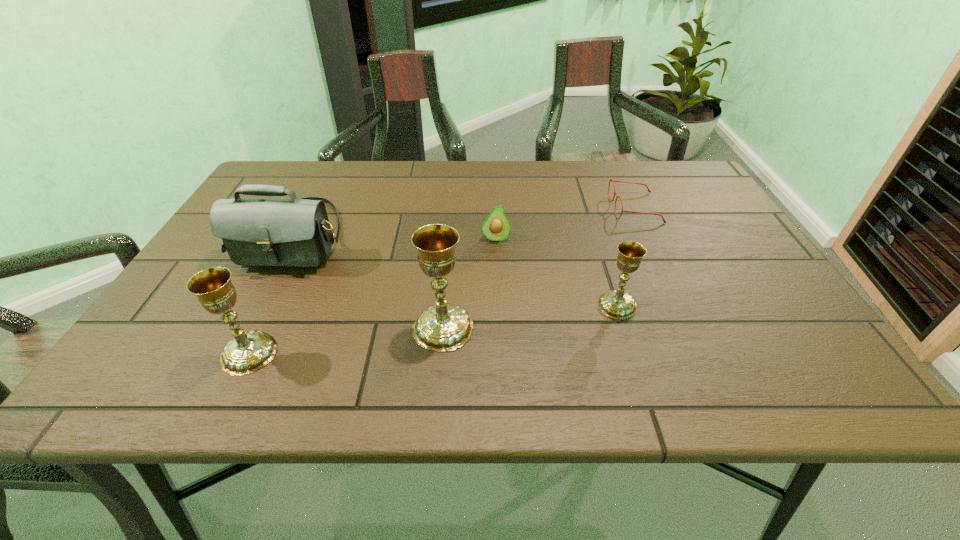
Please point a spot on the right to add another chalice. Please provide its 2D coordinates. Your answer should be formatted as a tuple, i.e. [(x, y)], where the tuple contains the x and y coordinates of a point satisfying the conditions above.

[(774, 285)]